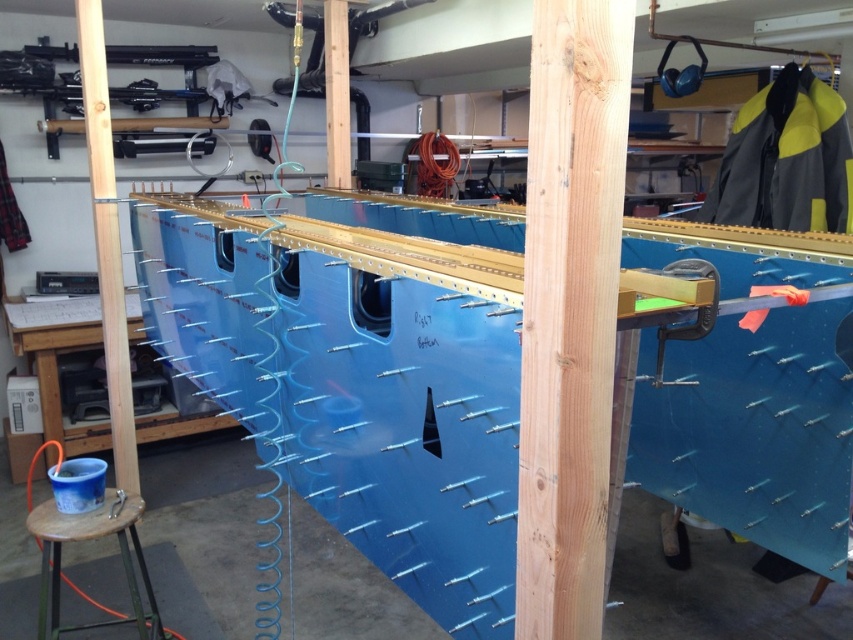
Which is above, blue plastic bucket at lower left or matte wood beam at center?

matte wood beam at center is above.

Does point (132, 333) lie in front of point (328, 45)?

No, it is behind (328, 45).

Find the location of a particular element. The height and width of the screenshot is (640, 853). blue plastic bucket at lower left is located at coordinates (56, 356).

Which is below, wooden beam at center or blue plastic bucket at lower left?

blue plastic bucket at lower left

The height and width of the screenshot is (640, 853). I want to click on wooden beam at center, so click(107, 241).

Does natural wood beam at center have a greater width compared to blue plastic bucket at lower left?

No, natural wood beam at center is not wider than blue plastic bucket at lower left.

Who is more distant from viewer, (x=537, y=304) or (x=94, y=449)?

The point (x=94, y=449) is more distant.

You are a GUI agent. You are given a task and a screenshot of the screen. Output one action in this format:
    pyautogui.click(x=<x>, y=<y>)
    Task: Click on the natural wood beam at center
    
    Given the screenshot: What is the action you would take?
    pyautogui.click(x=570, y=310)